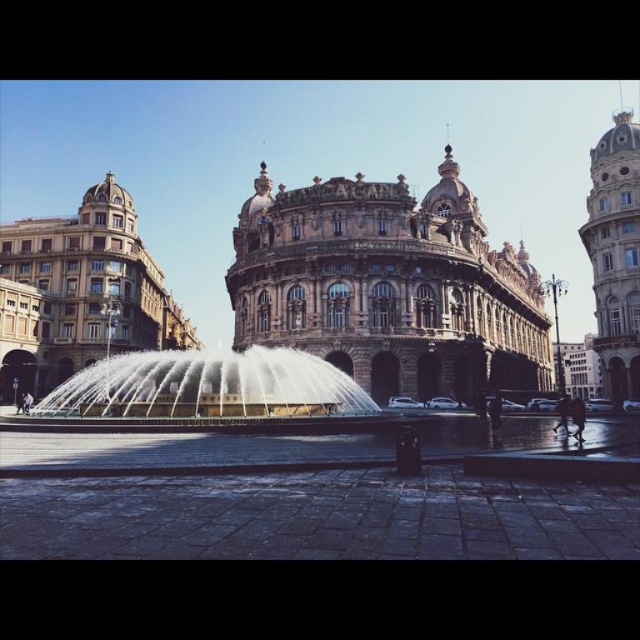
You are a tourist standing at the entrance of the grand building. You want to take a photo of the polished stone fountain at center. In which direction should you walk from the building to reach the fountain?

The polished stone fountain at center is located at point (316, 163), so you should walk towards the center of the square to reach it.

You are a tourist holding a camera and want to take a photo of the golden stone palace at center without the polished stone fountain at center blocking the view. Is it possible to do so from your current position in the square?

The polished stone fountain at center is positioned over golden stone palace at center, so it is blocking the view. You cannot take a photo of the golden stone palace at center without the fountain blocking it from your current position in the square.